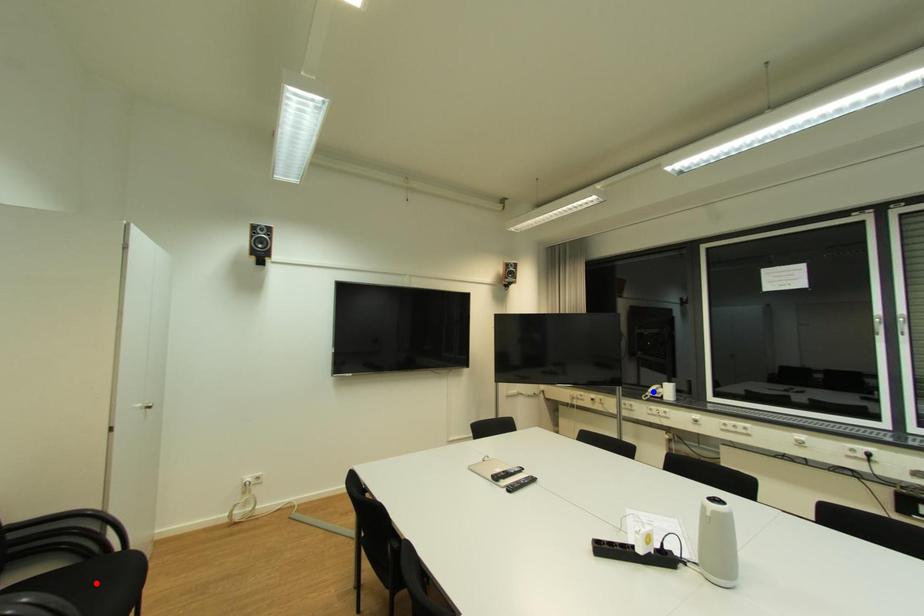
Question: Which of the two points in the image is closer to the camera?

Choices:
 (A) Blue point is closer.
 (B) Red point is closer.

Answer: (B)